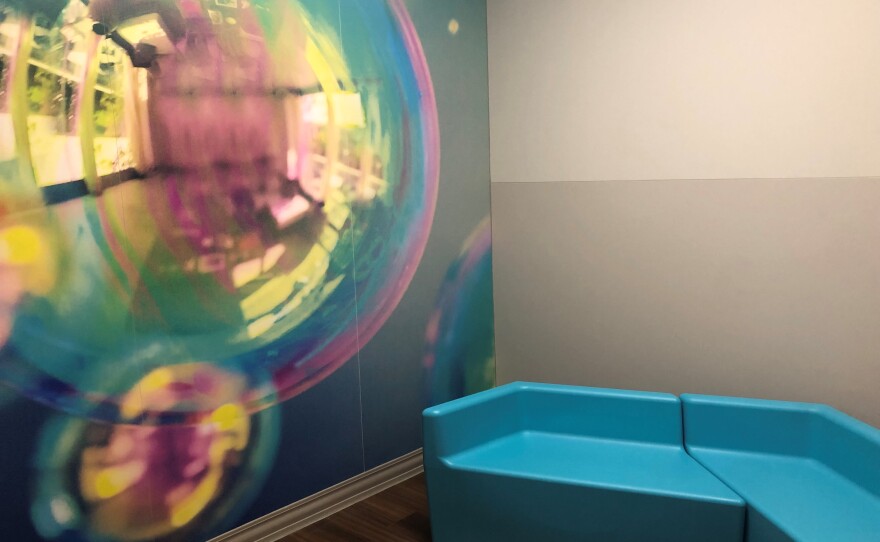
Locate an element on the screen. This screenshot has height=542, width=880. green wall is located at coordinates (468, 134).